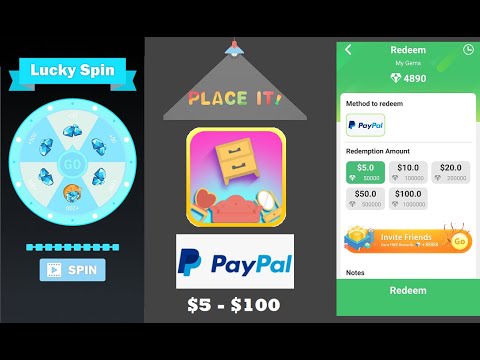
The width and height of the screenshot is (480, 360). In order to click on back of chair shaped like a heart in this screenshot , I will do `click(202, 201)`.